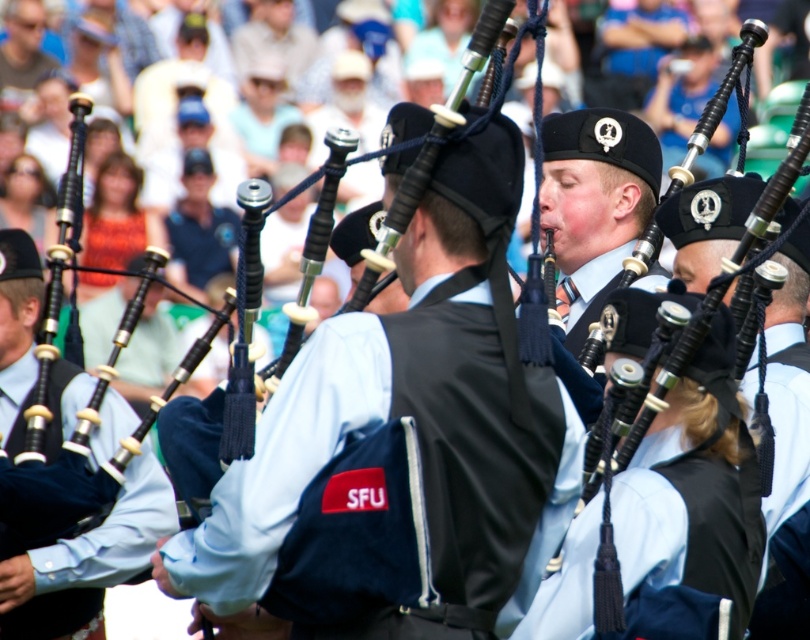
Who is lower down, matte black vest at center or matte black bagpipes at center?

matte black bagpipes at center

Does matte black vest at center have a greater height compared to matte black bagpipes at center?

Incorrect, matte black vest at center's height is not larger of matte black bagpipes at center's.

Measure the distance between point (x=518, y=556) and camera.

119.08 feet

Image resolution: width=810 pixels, height=640 pixels. In order to click on matte black vest at center in this screenshot , I will do tap(416, 420).